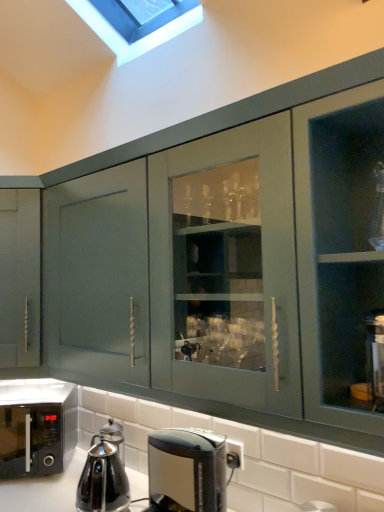
What do you see at coordinates (37, 428) in the screenshot?
I see `black glossy microwave at lower left` at bounding box center [37, 428].

Where is `black glossy coffee maker at lower center`? This screenshot has height=512, width=384. black glossy coffee maker at lower center is located at coordinates (188, 470).

At what (x,y) coordinates should I click in order to perform the action: click on black glossy microwave at lower left. Please return your answer as a coordinate pair (x, y). The height and width of the screenshot is (512, 384). Looking at the image, I should click on (37, 428).

How many degrees apart are the facing directions of black glossy coffee maker at lower center and black glossy microwave at lower left?

There is a 49.3-degree angle between the facing directions of black glossy coffee maker at lower center and black glossy microwave at lower left.

Which of these two, black glossy coffee maker at lower center or black glossy microwave at lower left, is wider?

With larger width is black glossy microwave at lower left.

Can black glossy microwave at lower left be found inside black glossy coffee maker at lower center?

No, black glossy microwave at lower left is not surrounded by black glossy coffee maker at lower center.

Could you tell me if black glossy coffee maker at lower center is facing black glossy microwave at lower left?

No.

Is black glossy coffee maker at lower center at the back of black glossy microwave at lower left?

black glossy microwave at lower left does not have its back to black glossy coffee maker at lower center.

In the image, is black glossy microwave at lower left positioned in front of or behind black glossy coffee maker at lower center?

black glossy microwave at lower left is positioned farther from the viewer than black glossy coffee maker at lower center.

From the image's perspective, between black glossy microwave at lower left and black glossy coffee maker at lower center, which one is located above?

black glossy coffee maker at lower center, from the image's perspective.

Considering the relative sizes of black glossy microwave at lower left and black glossy coffee maker at lower center in the image provided, is black glossy microwave at lower left bigger than black glossy coffee maker at lower center?

Correct, black glossy microwave at lower left is larger in size than black glossy coffee maker at lower center.

Is black glossy microwave at lower left with stainless steel kettle at lower left?

No, black glossy microwave at lower left is not beside stainless steel kettle at lower left.

Is black glossy microwave at lower left situated inside stainless steel kettle at lower left or outside?

black glossy microwave at lower left is located beyond the bounds of stainless steel kettle at lower left.

Between black glossy microwave at lower left and stainless steel kettle at lower left, which one appears on the left side from the viewer's perspective?

Positioned to the left is black glossy microwave at lower left.

Does point (39, 385) appear closer or farther from the camera than point (123, 483)?

Point (39, 385) is positioned farther from the camera compared to point (123, 483).

Is stainless steel kettle at lower left wider or thinner than black glossy microwave at lower left?

Considering their sizes, stainless steel kettle at lower left looks slimmer than black glossy microwave at lower left.

Is point (100, 483) positioned before point (50, 467)?

Yes, point (100, 483) is closer to viewer.

Is stainless steel kettle at lower left oriented towards black glossy microwave at lower left?

No, stainless steel kettle at lower left does not turn towards black glossy microwave at lower left.

Which is more to the right, stainless steel kettle at lower left or black glossy microwave at lower left?

stainless steel kettle at lower left is more to the right.

In the scene shown: Considering their positions, is stainless steel kettle at lower left located in front of or behind black glossy coffee maker at lower center?

In the image, stainless steel kettle at lower left appears behind black glossy coffee maker at lower center.

Which object is wider, stainless steel kettle at lower left or black glossy coffee maker at lower center?

black glossy coffee maker at lower center is wider.

From the image's perspective, between stainless steel kettle at lower left and black glossy coffee maker at lower center, who is located below?

stainless steel kettle at lower left is shown below in the image.

This screenshot has height=512, width=384. What are the coordinates of `coffee maker in front of the stainless steel kettle at lower left` in the screenshot? It's located at (188, 470).

Is black glossy coffee maker at lower center further to the viewer compared to stainless steel kettle at lower left?

No, black glossy coffee maker at lower center is closer to the camera.

From the image's perspective, which object appears higher, black glossy coffee maker at lower center or stainless steel kettle at lower left?

black glossy coffee maker at lower center is shown above in the image.

How different are the orientations of black glossy coffee maker at lower center and stainless steel kettle at lower left in degrees?

There is a 6-degree angle between the facing directions of black glossy coffee maker at lower center and stainless steel kettle at lower left.

Which of these two, black glossy coffee maker at lower center or stainless steel kettle at lower left, stands taller?

Standing taller between the two is black glossy coffee maker at lower center.

Identify the location of home appliance below the black glossy coffee maker at lower center (from the image's perspective). The height and width of the screenshot is (512, 384). (37, 428).

The image size is (384, 512). Find the location of `coffee maker on the right of black glossy microwave at lower left`. coffee maker on the right of black glossy microwave at lower left is located at coordinates (188, 470).

From the image, which object appears to be nearer to black glossy coffee maker at lower center, black glossy microwave at lower left or stainless steel kettle at lower left?

stainless steel kettle at lower left lies closer to black glossy coffee maker at lower center than the other object.

Estimate the real-world distances between objects in this image. Which object is closer to black glossy microwave at lower left, black glossy coffee maker at lower center or stainless steel kettle at lower left?

stainless steel kettle at lower left is positioned closer to the anchor black glossy microwave at lower left.

Which object lies nearer to the anchor point black glossy microwave at lower left, stainless steel kettle at lower left or black glossy coffee maker at lower center?

Based on the image, stainless steel kettle at lower left appears to be nearer to black glossy microwave at lower left.

When comparing their distances from stainless steel kettle at lower left, does black glossy microwave at lower left or black glossy coffee maker at lower center seem further?

black glossy coffee maker at lower center is positioned further to the anchor stainless steel kettle at lower left.

Which object lies further to the anchor point stainless steel kettle at lower left, black glossy coffee maker at lower center or black glossy microwave at lower left?

black glossy coffee maker at lower center is further to stainless steel kettle at lower left.

When comparing their distances from black glossy coffee maker at lower center, does stainless steel kettle at lower left or black glossy microwave at lower left seem closer?

stainless steel kettle at lower left.

Where is `kitchen appliance positioned between black glossy coffee maker at lower center and black glossy microwave at lower left from near to far`? This screenshot has width=384, height=512. kitchen appliance positioned between black glossy coffee maker at lower center and black glossy microwave at lower left from near to far is located at coordinates (103, 480).